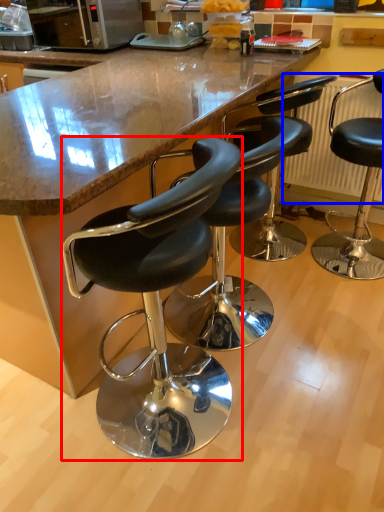
Question: Which object is further to the camera taking this photo, chair (highlighted by a red box) or radiator (highlighted by a blue box)?

Choices:
 (A) chair
 (B) radiator

Answer: (B)